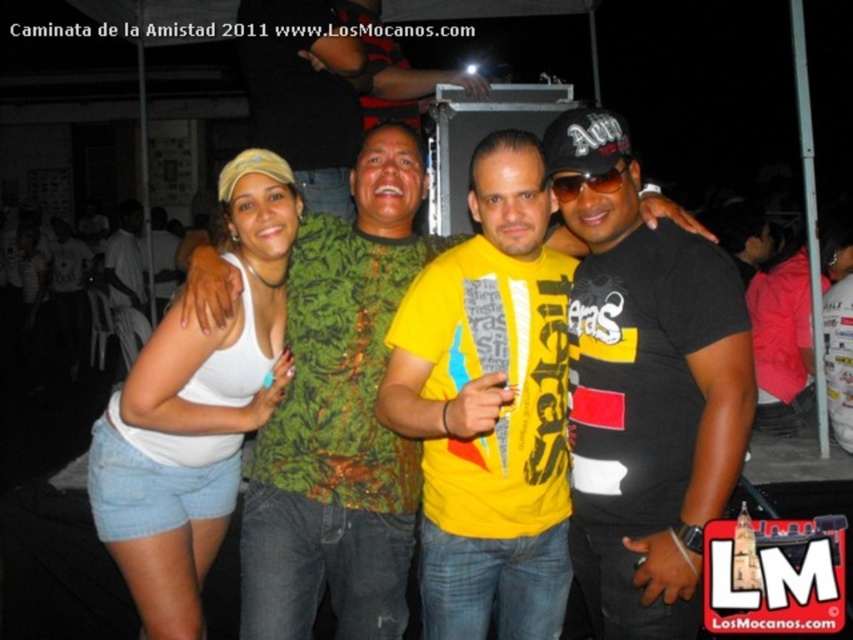
Question: Can you confirm if black matte t-shirt at center is thinner than yellow printed t-shirt at center?

Choices:
 (A) yes
 (B) no

Answer: (A)

Question: Based on their relative distances, which object is farther from the black matte t-shirt at center?

Choices:
 (A) white fabric tank top at left
 (B) yellow printed t-shirt at center

Answer: (A)

Question: Does black matte t-shirt at center have a larger size compared to white fabric tank top at center?

Choices:
 (A) yes
 (B) no

Answer: (B)

Question: Which is farther from the yellow printed t-shirt at center?

Choices:
 (A) black matte t-shirt at center
 (B) white fabric tank top at left

Answer: (B)

Question: Observing the image, what is the correct spatial positioning of yellow printed t-shirt at center in reference to white fabric tank top at center?

Choices:
 (A) above
 (B) below

Answer: (B)

Question: Considering the real-world distances, which object is farthest from the white fabric tank top at center?

Choices:
 (A) black matte t-shirt at center
 (B) yellow printed t-shirt at center
 (C) white fabric tank top at left

Answer: (A)